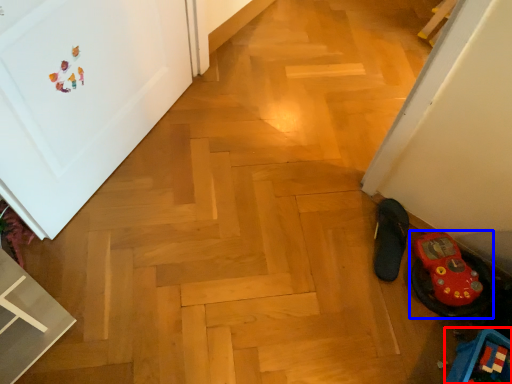
Question: Which object is further to the camera taking this photo, toy (highlighted by a red box) or footwear (highlighted by a blue box)?

Choices:
 (A) toy
 (B) footwear

Answer: (B)